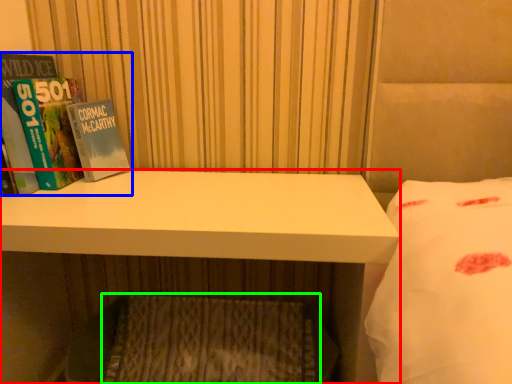
Question: Which object is the closest to the desk (highlighted by a red box)? Choose among these: book (highlighted by a blue box) or mattress (highlighted by a green box).

Choices:
 (A) book
 (B) mattress

Answer: (A)